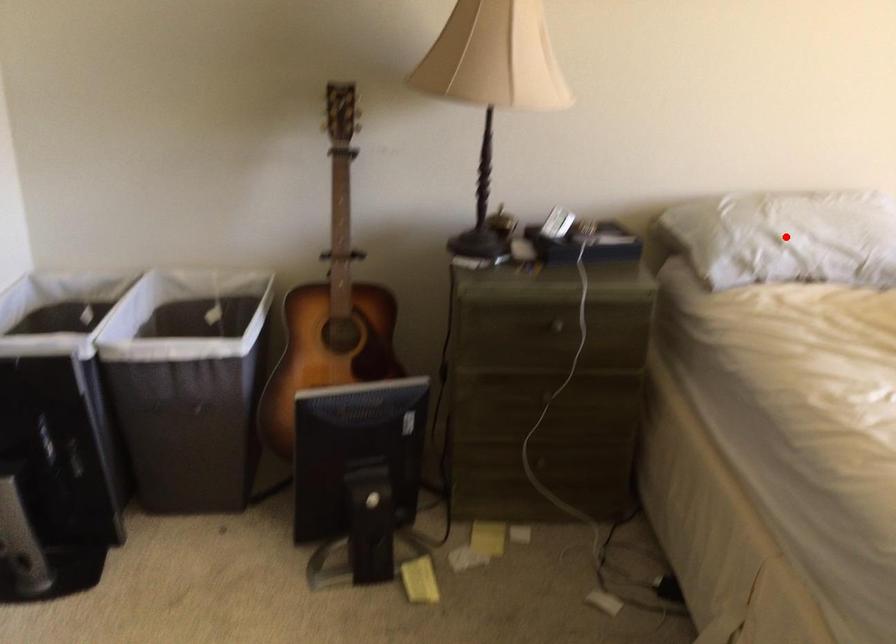
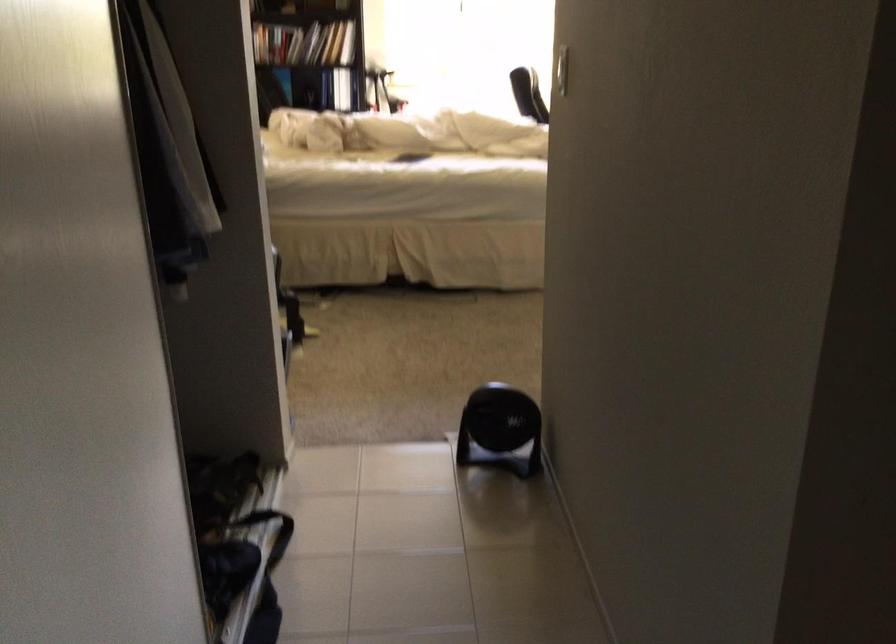
Question: I am providing you with two images of the same scene from different viewpoints. A red point is marked on the first image. At the location where the point appears in image 1, is it still visible in image 2?

Choices:
 (A) Yes
 (B) No

Answer: (B)